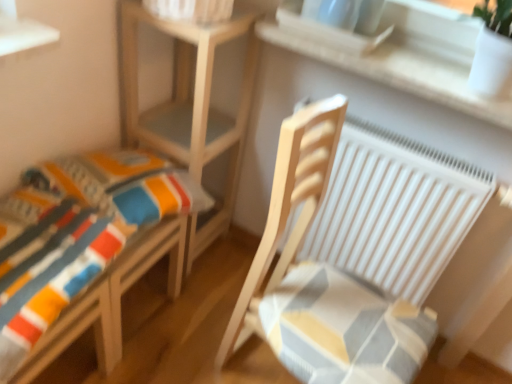
Describe the element at coordinates (411, 57) in the screenshot. This screenshot has height=384, width=512. I see `white stone window sill at upper center` at that location.

The width and height of the screenshot is (512, 384). Describe the element at coordinates (323, 279) in the screenshot. I see `wooden rocking chair at right` at that location.

The height and width of the screenshot is (384, 512). I want to click on white matte radiator at right, so [395, 210].

Is wooden rocking chair at right next to natural wood table at center and touching it?

There is a gap between wooden rocking chair at right and natural wood table at center.

Consider the image. From a real-world perspective, which is physically below, wooden rocking chair at right or natural wood table at center?

wooden rocking chair at right.

Is wooden rocking chair at right not inside natural wood table at center?

Absolutely, wooden rocking chair at right is external to natural wood table at center.

Does wooden rocking chair at right turn towards natural wood table at center?

No, wooden rocking chair at right is not aimed at natural wood table at center.

Is wooden rocking chair at right to the left of striped fabric cushion at lower left from the viewer's perspective?

In fact, wooden rocking chair at right is to the right of striped fabric cushion at lower left.

Consider the image. Which is correct: wooden rocking chair at right is inside striped fabric cushion at lower left, or outside of it?

wooden rocking chair at right is not enclosed by striped fabric cushion at lower left.

You are a GUI agent. You are given a task and a screenshot of the screen. Output one action in this format:
    pyautogui.click(x=<x>, y=<y>)
    Task: Click on the furniture behind the wooden rocking chair at right
    
    Given the screenshot: What is the action you would take?
    pyautogui.click(x=84, y=249)

From a real-world perspective, is wooden rocking chair at right positioned above or below striped fabric cushion at lower left?

wooden rocking chair at right is situated lower than striped fabric cushion at lower left in the real world.

Looking at the image, does white matte radiator at right seem bigger or smaller compared to wooden rocking chair at right?

Clearly, white matte radiator at right is smaller in size than wooden rocking chair at right.

Is white matte radiator at right next to wooden rocking chair at right and touching it?

No, white matte radiator at right is not touching wooden rocking chair at right.

From a real-world perspective, relative to wooden rocking chair at right, is white matte radiator at right vertically above or below?

From a real-world perspective, white matte radiator at right is physically below wooden rocking chair at right.

Can you tell me how much white matte radiator at right and wooden rocking chair at right differ in facing direction?

84.4 degrees separate the facing orientations of white matte radiator at right and wooden rocking chair at right.

From a real-world perspective, which object stands above the other?

From a 3D spatial view, white stone window sill at upper center is above.

Consider the image. From the image's perspective, is striped fabric cushion at lower left above or below white stone window sill at upper center?

striped fabric cushion at lower left is situated lower than white stone window sill at upper center in the image.

How far apart are striped fabric cushion at lower left and white stone window sill at upper center?

striped fabric cushion at lower left is 30.11 inches from white stone window sill at upper center.

Can we say striped fabric cushion at lower left lies outside white stone window sill at upper center?

striped fabric cushion at lower left lies outside white stone window sill at upper center's area.

Considering the relative sizes of white stone window sill at upper center and striped fabric cushion at lower left in the image provided, is white stone window sill at upper center smaller than striped fabric cushion at lower left?

Yes.

Is white stone window sill at upper center far from striped fabric cushion at lower left?

No, white stone window sill at upper center is not far from striped fabric cushion at lower left.

From the picture: Can you confirm if white stone window sill at upper center is shorter than striped fabric cushion at lower left?

Indeed, white stone window sill at upper center has a lesser height compared to striped fabric cushion at lower left.

Which is more distant, (461, 88) or (70, 298)?

Positioned behind is point (461, 88).

From a real-world perspective, is white stone window sill at upper center physically located above or below natural wood table at center?

Clearly, from a real-world perspective, white stone window sill at upper center is above natural wood table at center.

Which point is more forward, (x=402, y=12) or (x=176, y=30)?

The point (x=176, y=30) is more forward.

Can you confirm if white stone window sill at upper center is taller than natural wood table at center?

No, white stone window sill at upper center is not taller than natural wood table at center.

Considering the sizes of objects white matte radiator at right and striped fabric cushion at lower left in the image provided, who is wider, white matte radiator at right or striped fabric cushion at lower left?

With larger width is striped fabric cushion at lower left.

Would you consider white matte radiator at right to be distant from striped fabric cushion at lower left?

white matte radiator at right is actually quite close to striped fabric cushion at lower left.

Looking at this image, considering the sizes of white matte radiator at right and striped fabric cushion at lower left in the image, is white matte radiator at right taller or shorter than striped fabric cushion at lower left?

Clearly, white matte radiator at right is taller compared to striped fabric cushion at lower left.

From the image's perspective, is white matte radiator at right over striped fabric cushion at lower left?

Yes, from the image's perspective, white matte radiator at right is above striped fabric cushion at lower left.

Image resolution: width=512 pixels, height=384 pixels. I want to click on rocking chair on the right of natural wood table at center, so coord(323,279).

The image size is (512, 384). Identify the location of furniture above the wooden rocking chair at right (from the image's perspective). pos(84,249).

Looking at the image, which one is located further to natural wood table at center, striped fabric cushion at lower left or white stone window sill at upper center?

white stone window sill at upper center lies further to natural wood table at center than the other object.

Based on their spatial positions, is wooden rocking chair at right or striped fabric cushion at lower left closer to white stone window sill at upper center?

The object closer to white stone window sill at upper center is wooden rocking chair at right.

From the image, which object appears to be farther from striped fabric cushion at lower left, wooden rocking chair at right or natural wood table at center?

wooden rocking chair at right lies further to striped fabric cushion at lower left than the other object.

Looking at the image, which one is located further to striped fabric cushion at lower left, white stone window sill at upper center or wooden rocking chair at right?

Based on the image, white stone window sill at upper center appears to be further to striped fabric cushion at lower left.

Estimate the real-world distances between objects in this image. Which object is closer to white stone window sill at upper center, white matte radiator at right or natural wood table at center?

Among the two, white matte radiator at right is located nearer to white stone window sill at upper center.

Which object lies further to the anchor point white stone window sill at upper center, striped fabric cushion at lower left or natural wood table at center?

striped fabric cushion at lower left is further to white stone window sill at upper center.

Which object lies further to the anchor point wooden rocking chair at right, white stone window sill at upper center or natural wood table at center?

Based on the image, natural wood table at center appears to be further to wooden rocking chair at right.

Estimate the real-world distances between objects in this image. Which object is closer to wooden rocking chair at right, white matte radiator at right or white stone window sill at upper center?

white matte radiator at right is closer to wooden rocking chair at right.

Where is `table between white stone window sill at upper center and wooden rocking chair at right vertically`? table between white stone window sill at upper center and wooden rocking chair at right vertically is located at coordinates (189, 107).

Find the location of a particular element. The image size is (512, 384). window sill located between striped fabric cushion at lower left and white matte radiator at right in the left-right direction is located at coordinates (411, 57).

Locate an element on the screen. This screenshot has height=384, width=512. window sill between natural wood table at center and white matte radiator at right in the horizontal direction is located at coordinates (411, 57).

I want to click on radiator between white stone window sill at upper center and wooden rocking chair at right from top to bottom, so click(x=395, y=210).